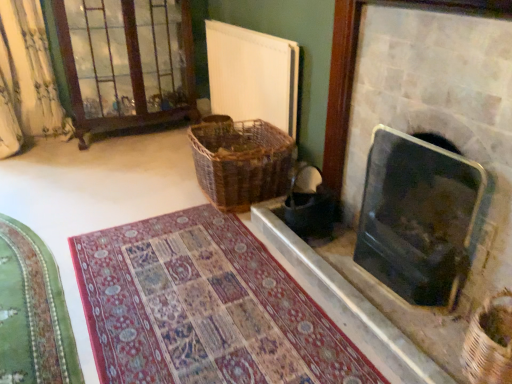
At what (x,y) coordinates should I click in order to perform the action: click on free location to the left of woven brown basket at center, which is the 2th basket in front-to-back order. Please return your answer as a coordinate pair (x, y). Looking at the image, I should click on (155, 190).